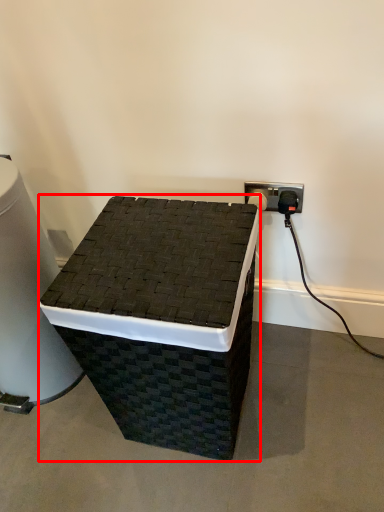
Question: From the image's perspective, what is the correct spatial relationship of furniture (annotated by the red box) in relation to water cooler?

Choices:
 (A) below
 (B) above

Answer: (A)